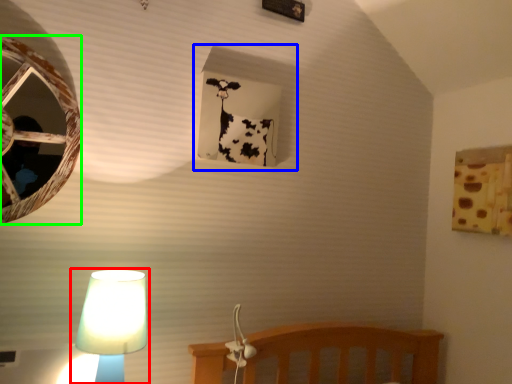
Question: Estimate the real-world distances between objects in this image. Which object is closer to lamp (highlighted by a red box), window frame (highlighted by a blue box) or oval (highlighted by a green box)?

Choices:
 (A) window frame
 (B) oval

Answer: (B)